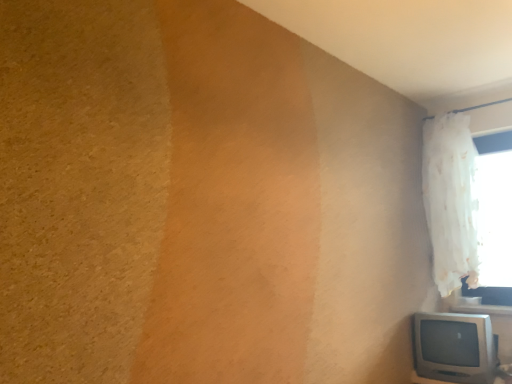
Question: Visually, is white sheer curtain at upper right positioned to the left or to the right of matte silver television at lower right?

Choices:
 (A) right
 (B) left

Answer: (A)

Question: Does point tap(421, 173) appear closer or farther from the camera than point tap(465, 349)?

Choices:
 (A) farther
 (B) closer

Answer: (A)

Question: Is white sheer curtain at upper right bigger or smaller than matte silver television at lower right?

Choices:
 (A) big
 (B) small

Answer: (A)

Question: From the image's perspective, relative to white sheer curtain at upper right, is matte silver television at lower right above or below?

Choices:
 (A) above
 (B) below

Answer: (B)

Question: Considering the positions of matte silver television at lower right and white sheer curtain at upper right in the image, is matte silver television at lower right bigger or smaller than white sheer curtain at upper right?

Choices:
 (A) small
 (B) big

Answer: (A)

Question: Is matte silver television at lower right to the left or to the right of white sheer curtain at upper right in the image?

Choices:
 (A) right
 (B) left

Answer: (B)

Question: Considering the positions of matte silver television at lower right and white sheer curtain at upper right in the image, is matte silver television at lower right wider or thinner than white sheer curtain at upper right?

Choices:
 (A) thin
 (B) wide

Answer: (B)